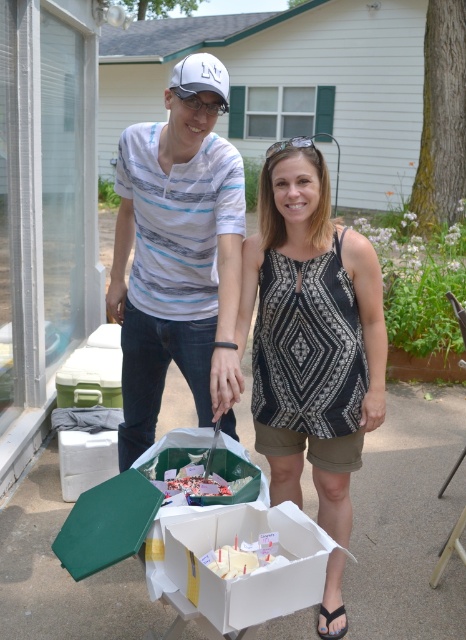
Is black printed tank top at center in front of white cardboard box at center?

That is False.

Between black printed tank top at center and white cardboard box at center, which one appears on the left side from the viewer's perspective?

From the viewer's perspective, white cardboard box at center appears more on the left side.

Is point (349, 244) behind point (327, 552)?

That is True.

At what (x,y) coordinates should I click in order to perform the action: click on black printed tank top at center. Please return your answer as a coordinate pair (x, y). The height and width of the screenshot is (640, 466). Looking at the image, I should click on (310, 336).

Who is positioned more to the left, striped cotton shirt at center or white frosted cake at center?

From the viewer's perspective, striped cotton shirt at center appears more on the left side.

Is point (216, 196) farther from viewer compared to point (240, 556)?

Yes, it is.

This screenshot has width=466, height=640. I want to click on striped cotton shirt at center, so click(178, 256).

From the picture: Is black printed tank top at center to the left of black fabric sandal at lower center from the viewer's perspective?

Correct, you'll find black printed tank top at center to the left of black fabric sandal at lower center.

Can you confirm if black printed tank top at center is positioned below black fabric sandal at lower center?

Actually, black printed tank top at center is above black fabric sandal at lower center.

Between point (368, 362) and point (340, 634), which one is positioned behind?

The point (340, 634) is more distant.

At what (x,y) coordinates should I click in order to perform the action: click on black printed tank top at center. Please return your answer as a coordinate pair (x, y). Looking at the image, I should click on (310, 336).